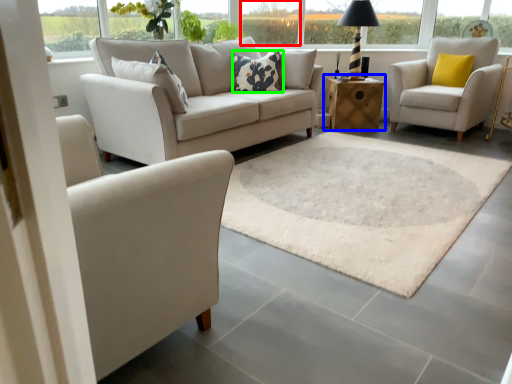
Question: Which is nearer to the window (highlighted by a red box)? table (highlighted by a blue box) or pillow (highlighted by a green box).

Choices:
 (A) table
 (B) pillow

Answer: (A)